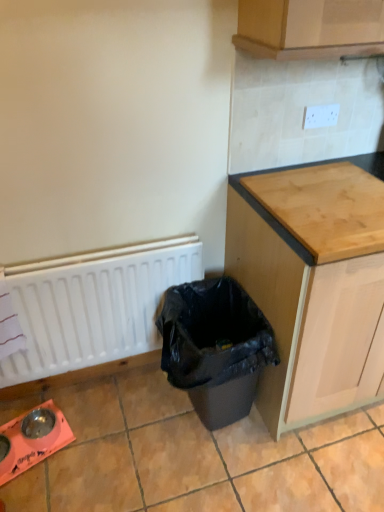
Where is `vacant space underneath white matte radiator at lower left (from a real-world perspective)`? vacant space underneath white matte radiator at lower left (from a real-world perspective) is located at coordinates (99, 382).